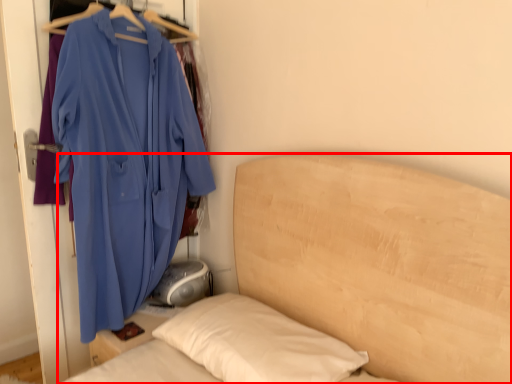
Question: From the image's perspective, what is the correct spatial positioning of bed (annotated by the red box) in reference to jacket?

Choices:
 (A) above
 (B) below

Answer: (B)